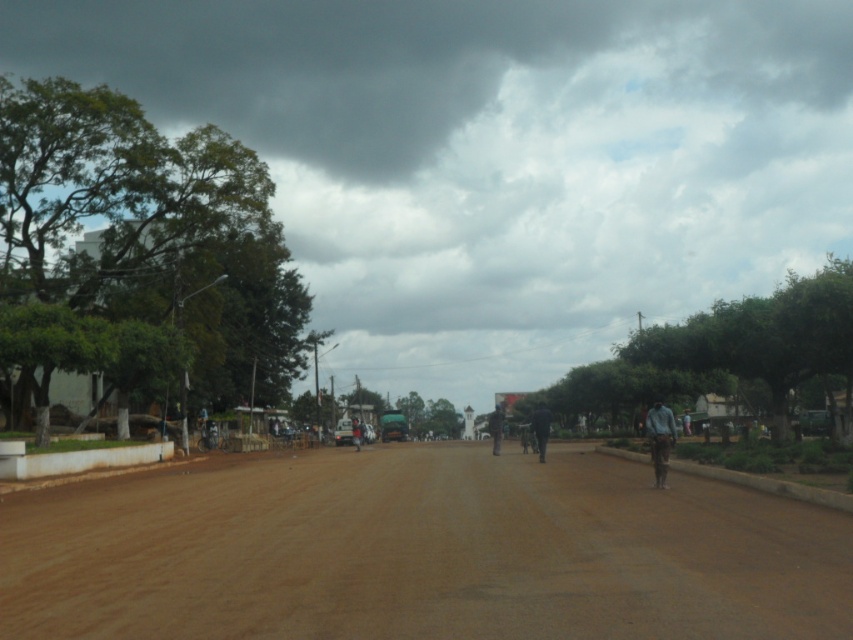
Measure the distance from light blue fabric shirt at right to dark blue uniform at center.

They are 11.41 meters apart.

Is light blue fabric shirt at right to the right of dark blue uniform at center from the viewer's perspective?

Indeed, light blue fabric shirt at right is positioned on the right side of dark blue uniform at center.

Identify the location of light blue fabric shirt at right. (659, 440).

What are the coordinates of `light blue fabric shirt at right` in the screenshot? It's located at (659, 440).

Can you confirm if dark blue uniform at center is positioned to the left of dark blue fabric person at center?

Incorrect, dark blue uniform at center is not on the left side of dark blue fabric person at center.

Measure the distance from dark blue uniform at center to dark blue fabric person at center.

dark blue uniform at center and dark blue fabric person at center are 51.97 feet apart from each other.

In order to click on dark blue uniform at center in this screenshot , I will do `click(541, 428)`.

Which of these two, dark blue shirt at center or dark blue fabric person at center, stands taller?

dark blue shirt at center

At what (x,y) coordinates should I click in order to perform the action: click on dark blue shirt at center. Please return your answer as a coordinate pair (x, y). Looking at the image, I should click on (496, 428).